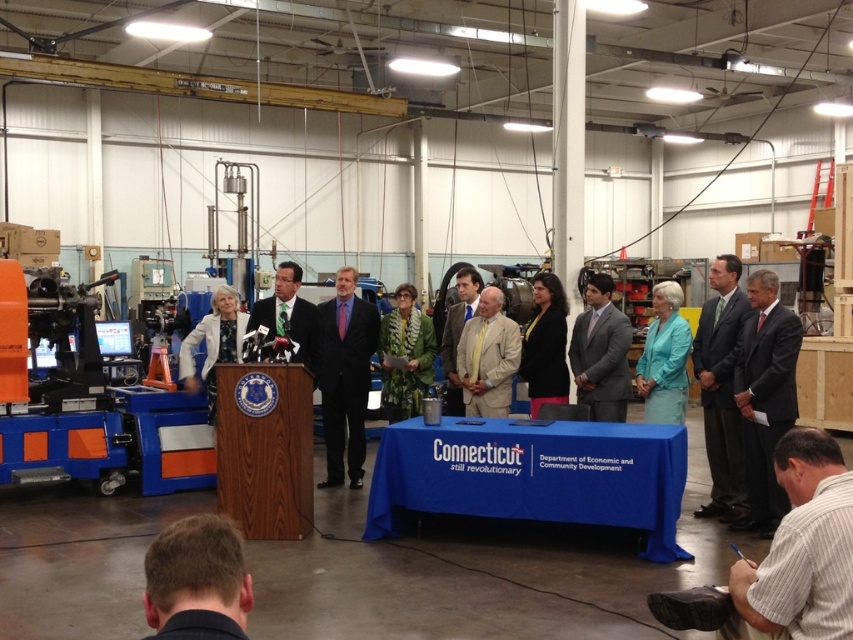
Is point (599, 362) farther from camera compared to point (308, 321)?

No.

What do you see at coordinates (601, 353) in the screenshot?
I see `gray suit at center` at bounding box center [601, 353].

The width and height of the screenshot is (853, 640). Describe the element at coordinates (601, 353) in the screenshot. I see `gray suit at center` at that location.

The width and height of the screenshot is (853, 640). I want to click on gray suit at center, so point(601,353).

Is beige fabric suit at center taller than white textured blazer at center?

No, beige fabric suit at center is not taller than white textured blazer at center.

Which is more to the left, beige fabric suit at center or white textured blazer at center?

white textured blazer at center

Which is behind, point (463, 355) or point (219, 332)?

Point (219, 332)

Where is `beige fabric suit at center`? Image resolution: width=853 pixels, height=640 pixels. beige fabric suit at center is located at coordinates (488, 356).

Does point (712, 515) come in front of point (515, 342)?

That is True.

Is point (735, 276) positioned after point (509, 384)?

No, (735, 276) is closer to viewer.

Locate an element on the screen. dark gray suit at center is located at coordinates (721, 388).